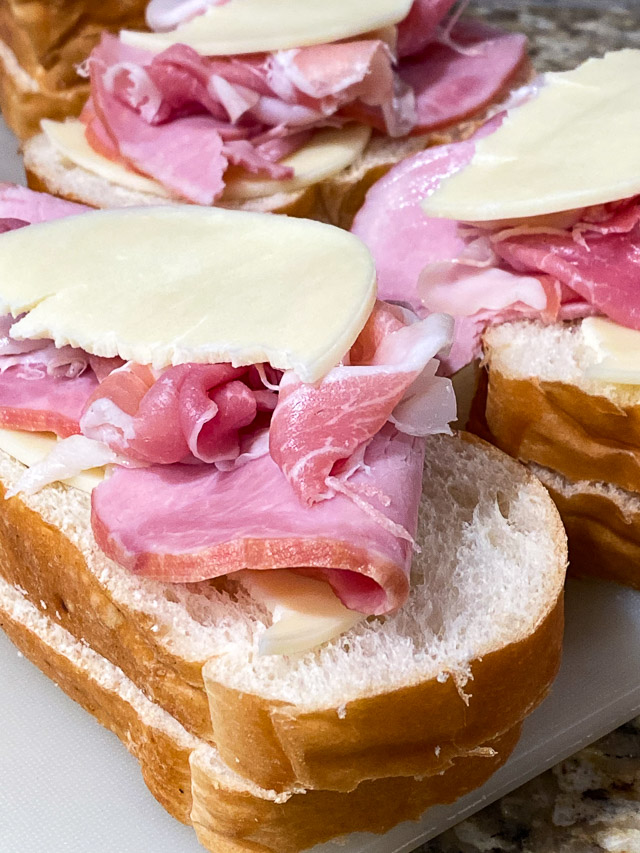
I want to click on gray object under table, so click(x=591, y=821).